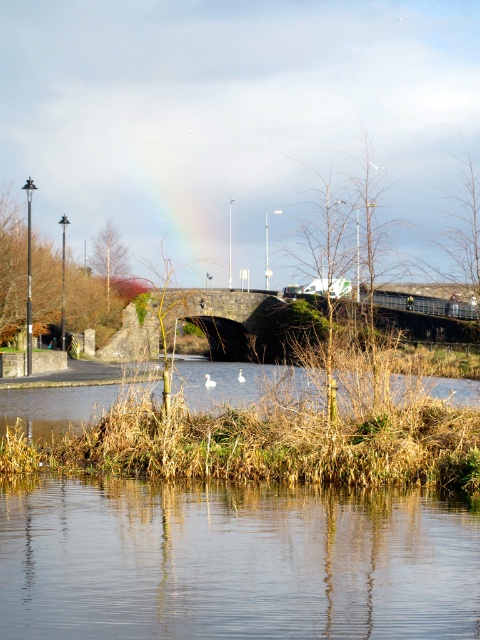
Who is more forward, (421, 536) or (478, 396)?

Point (421, 536) is in front.

Is transparent water at center thinner than brown grassy river at lower center?

Yes, transparent water at center is thinner than brown grassy river at lower center.

Is point (58, 540) closer to viewer compared to point (208, 394)?

Yes, it is in front of point (208, 394).

Where is `transparent water at center`? The image size is (480, 640). transparent water at center is located at coordinates (236, 561).